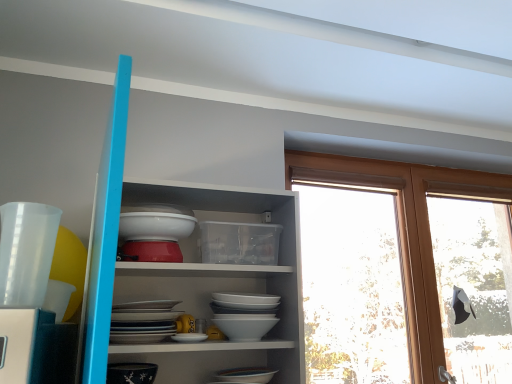
Question: Looking at the image, does white glossy shelves at upper center seem bigger or smaller compared to black glossy bowl at lower left, which ranks as the 1th tableware in bottom-to-top order?

Choices:
 (A) big
 (B) small

Answer: (A)

Question: In the image, is white glossy shelves at upper center on the left side or the right side of black glossy bowl at lower left, the second tableware in the front-to-back sequence?

Choices:
 (A) left
 (B) right

Answer: (B)

Question: Estimate the real-world distances between objects in this image. Which object is closer to the transparent glass window at upper right?

Choices:
 (A) white glossy bowl at center
 (B) white glossy shelves at upper center
 (C) transparent plastic cup at left, which is the first tableware in front-to-back order
 (D) black glossy bowl at lower left, which ranks as the 1th tableware in bottom-to-top order

Answer: (B)

Question: Estimate the real-world distances between objects in this image. Which object is closer to the white glossy bowl at center?

Choices:
 (A) white glossy shelves at upper center
 (B) black glossy bowl at lower left, which ranks as the 1th tableware in bottom-to-top order
 (C) transparent glass window at upper right
 (D) transparent plastic cup at left, which ranks as the first tableware in top-to-bottom order

Answer: (A)